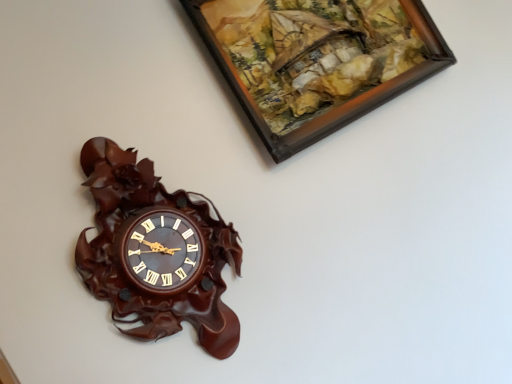
Where is `wooden frame at upper center`? wooden frame at upper center is located at coordinates (317, 60).

What do you see at coordinates (317, 60) in the screenshot?
I see `wooden frame at upper center` at bounding box center [317, 60].

Find the location of a particular element. The height and width of the screenshot is (384, 512). wooden frame at upper center is located at coordinates 317,60.